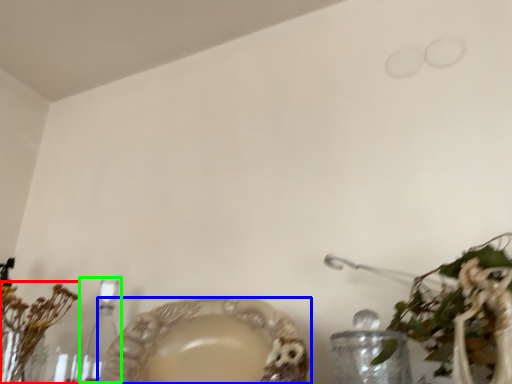
Question: Estimate the real-world distances between objects in this image. Which object is closer to floral arrangement (highlighted by a red box), tableware (highlighted by a blue box) or candle holder (highlighted by a green box)?

Choices:
 (A) tableware
 (B) candle holder

Answer: (B)